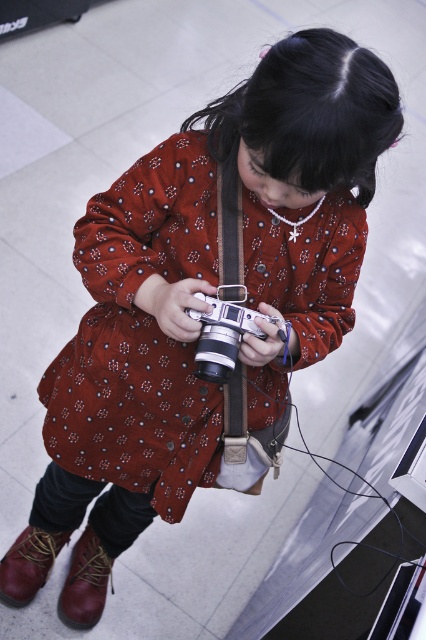
You are a photographer who wants to carry both the silver metallic camera at center and the leather boot at lower left in your bag. If your bag can only fit items up to the size of the camera, will the boot fit?

The silver metallic camera at center is wider than the leather boot at lower left. Since the boot is smaller in width than the camera, it will fit in the bag.

You are a photographer trying to capture the perfect shot of the brown leather boot at lower left. The camera you are using has a focal length of 50mm and you are standing 2 meters away from the boot. What is the minimum distance you need to move closer to ensure the boot fills the frame completely?

To determine the minimum distance needed, we can use the formula for calculating the required distance to fill the frame with an object. The formula is Distance_new Distance_original 50mm 50mm 50mm 50mm 50mm 50mm 50mm 50mm 50mm 50mm 50mm 50mm 50mm 50mm 50mm 50mm 50mm 50mm 50mm 50mm 50mm 50mm 50mm 50mm 50mm 50mm 50mm 50mm 50mm 50mm 50mm 50mm 50mm 50mm 50mm 50mm 50mm 50mm 50mm 50mm 50mm 50mm 50mm 50mm 50mm 50mm 50mm 50mm 50mm 50mm 50mm 50mm 50mm 50mm 50.